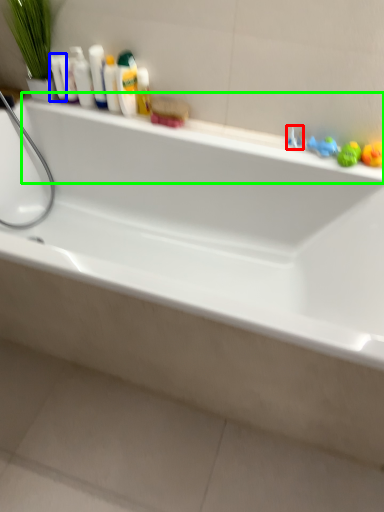
Question: Which is farther away from faucet (highlighted by a red box)? mouthwash (highlighted by a blue box) or ledge (highlighted by a green box)?

Choices:
 (A) mouthwash
 (B) ledge

Answer: (A)